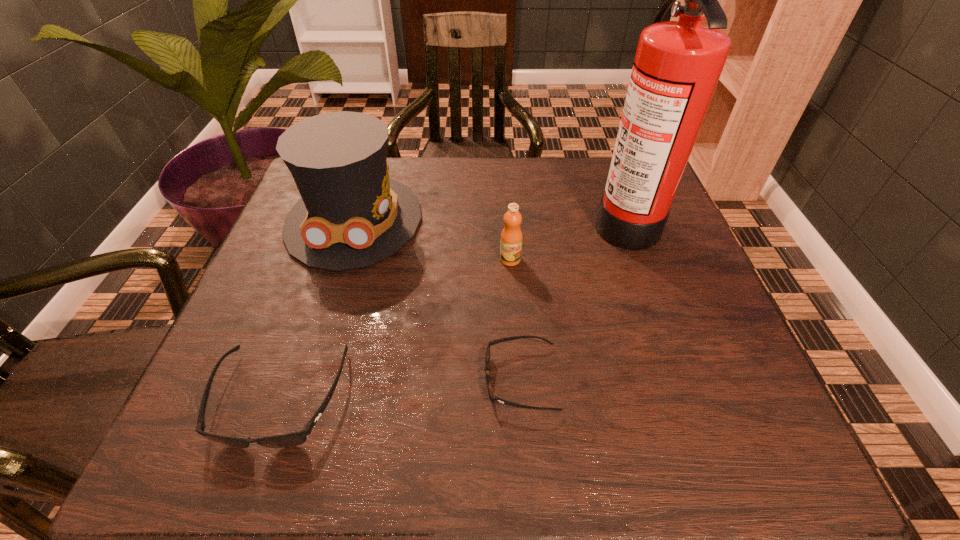
Where is `free region located on the front-facing side of the right sunglasses`? This screenshot has width=960, height=540. free region located on the front-facing side of the right sunglasses is located at coordinates (373, 379).

Image resolution: width=960 pixels, height=540 pixels. What are the coordinates of `free space located with goggles on the front of the dress hat` in the screenshot? It's located at point(322,322).

Locate an element on the screen. free space located on the front-facing side of the tallest object is located at coordinates (460, 220).

At what (x,y) coordinates should I click in order to perform the action: click on blank space located on the front-facing side of the tallest object. Please return your answer as a coordinate pair (x, y). Looking at the image, I should click on (572, 220).

Where is `vacant point located on the front-facing side of the tallest object`? vacant point located on the front-facing side of the tallest object is located at coordinates (472, 220).

This screenshot has width=960, height=540. I want to click on vacant space located 0.260m on the front label of the third tallest object, so click(518, 372).

At what (x,y) coordinates should I click in order to perform the action: click on dress hat positioned at the far edge. Please return your answer as a coordinate pair (x, y). This screenshot has height=540, width=960. Looking at the image, I should click on (351, 215).

The width and height of the screenshot is (960, 540). I want to click on fire extinguisher at the far edge, so click(x=677, y=66).

Locate an element on the screen. sunglasses located at the left edge is located at coordinates (293, 439).

The height and width of the screenshot is (540, 960). Identify the location of dress hat present at the left edge. (351, 215).